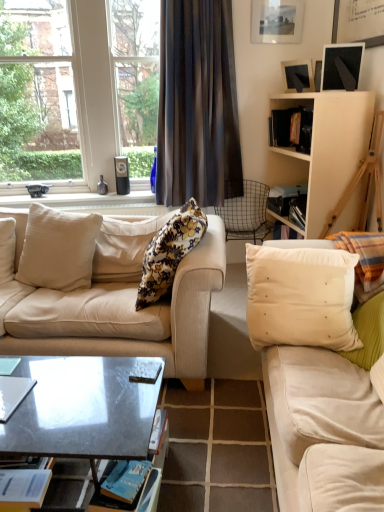
Question: From the image's perspective, would you say white matte cabinet at upper right is shown under dark fabric curtain at center?

Choices:
 (A) yes
 (B) no

Answer: (A)

Question: Considering the relative sizes of white matte cabinet at upper right and dark fabric curtain at center in the image provided, is white matte cabinet at upper right taller than dark fabric curtain at center?

Choices:
 (A) yes
 (B) no

Answer: (B)

Question: From a real-world perspective, is white matte cabinet at upper right positioned under dark fabric curtain at center based on gravity?

Choices:
 (A) yes
 (B) no

Answer: (A)

Question: Is white matte cabinet at upper right closer to the viewer compared to dark fabric curtain at center?

Choices:
 (A) yes
 (B) no

Answer: (A)

Question: Is white matte cabinet at upper right positioned with its back to dark fabric curtain at center?

Choices:
 (A) no
 (B) yes

Answer: (A)

Question: Is there a large distance between white matte cabinet at upper right and dark fabric curtain at center?

Choices:
 (A) yes
 (B) no

Answer: (B)

Question: Considering the relative sizes of beige fabric couch at left, the 2th studio couch when ordered from right to left, and matte black picture frame at upper right in the image provided, is beige fabric couch at left, the 2th studio couch when ordered from right to left, shorter than matte black picture frame at upper right?

Choices:
 (A) yes
 (B) no

Answer: (B)

Question: Is beige fabric couch at left, which is the first studio couch in left-to-right order, wider than matte black picture frame at upper right?

Choices:
 (A) yes
 (B) no

Answer: (A)

Question: Is beige fabric couch at left, the 2th studio couch when ordered from right to left, next to matte black picture frame at upper right and touching it?

Choices:
 (A) no
 (B) yes

Answer: (A)

Question: Is matte black picture frame at upper right completely or partially inside beige fabric couch at left, the 2th studio couch when ordered from right to left?

Choices:
 (A) yes
 (B) no

Answer: (B)

Question: Is beige fabric couch at left, which is the first studio couch in left-to-right order, not within matte black picture frame at upper right?

Choices:
 (A) yes
 (B) no

Answer: (A)

Question: Can you confirm if beige fabric couch at left, the 2th studio couch when ordered from right to left, is taller than matte black picture frame at upper right?

Choices:
 (A) yes
 (B) no

Answer: (A)

Question: Is blue paper magazine at lower left, marked as the 1th magazine in a bottom-to-top arrangement, shorter than white matte cabinet at upper right?

Choices:
 (A) yes
 (B) no

Answer: (A)